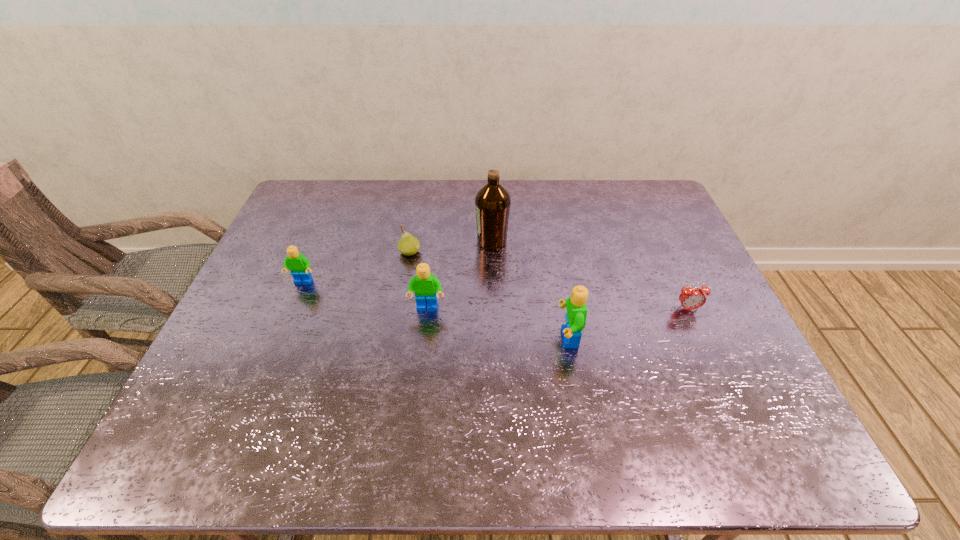
The image size is (960, 540). In order to click on the leftmost Lego in this screenshot , I will do (299, 265).

This screenshot has height=540, width=960. In order to click on the farthest Lego in this screenshot , I will do `click(299, 265)`.

Find the location of a particular element. the third tallest object is located at coordinates (425, 286).

What are the coordinates of `the second tallest Lego` in the screenshot? It's located at (425, 286).

At what (x,y) coordinates should I click in order to perform the action: click on the rightmost Lego. Please return your answer as a coordinate pair (x, y). Looking at the image, I should click on (576, 315).

I want to click on the second object from right to left, so click(x=576, y=315).

Locate an element on the screen. the tallest object is located at coordinates (492, 203).

At what (x,y) coordinates should I click in order to perform the action: click on the third object from right to left. Please return your answer as a coordinate pair (x, y). Looking at the image, I should click on (492, 203).

Locate an element on the screen. The height and width of the screenshot is (540, 960). alarm clock is located at coordinates (691, 298).

Where is `pear`? pear is located at coordinates (408, 245).